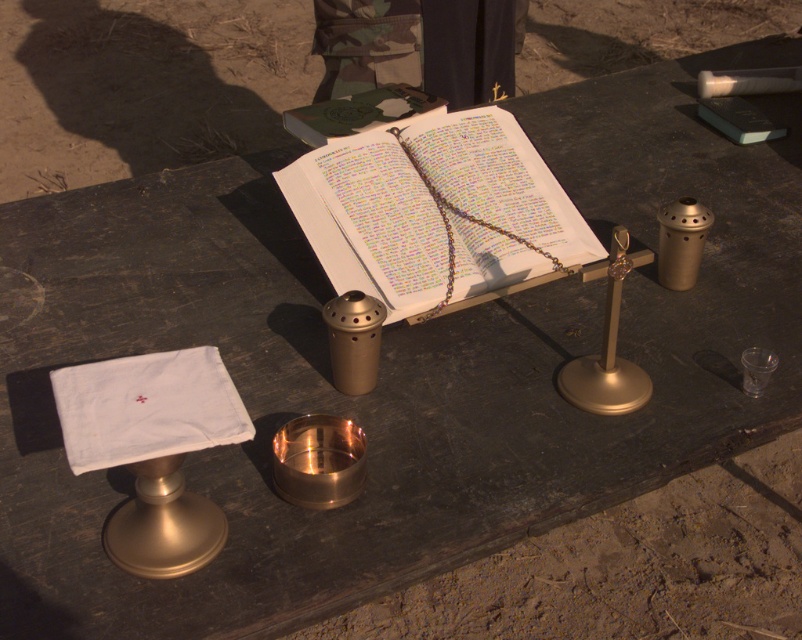
Question: Does white cloth at left lie in front of hardcover book at center?

Choices:
 (A) no
 (B) yes

Answer: (B)

Question: Can you confirm if white paper book at center is thinner than white cloth at left?

Choices:
 (A) no
 (B) yes

Answer: (A)

Question: Which object appears farthest from the camera in this image?

Choices:
 (A) white cloth at left
 (B) hardcover book at center

Answer: (B)

Question: Which of the following is the closest to the observer?

Choices:
 (A) white paper book at center
 (B) hardcover book at center
 (C) white cloth at left

Answer: (C)

Question: Estimate the real-world distances between objects in this image. Which object is farther from the white paper book at center?

Choices:
 (A) hardcover book at center
 (B) white cloth at left

Answer: (B)

Question: Does white paper book at center appear on the right side of white cloth at left?

Choices:
 (A) yes
 (B) no

Answer: (A)